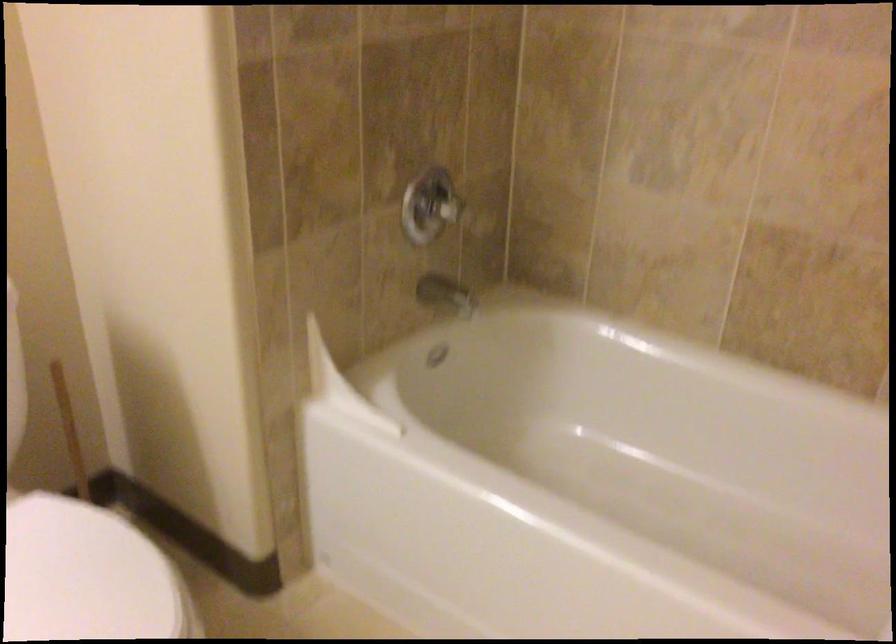
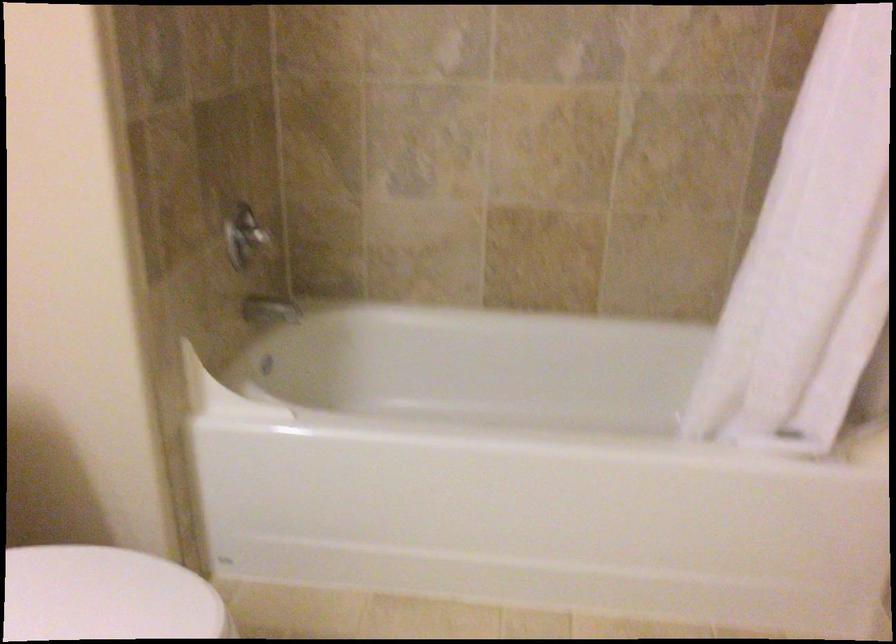
Question: Based on the continuous images, in which direction is the camera rotating? Reply with the corresponding letter.

Choices:
 (A) Left
 (B) Right
 (C) Up
 (D) Down

Answer: (B)